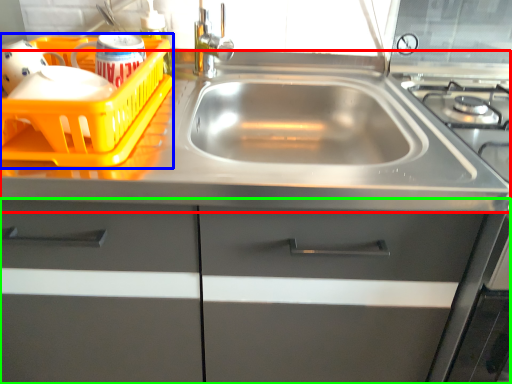
Question: Based on their relative distances, which object is nearer to counter top (highlighted by a red box)? Choose from basket (highlighted by a blue box) and cabinetry (highlighted by a green box).

Choices:
 (A) basket
 (B) cabinetry

Answer: (A)